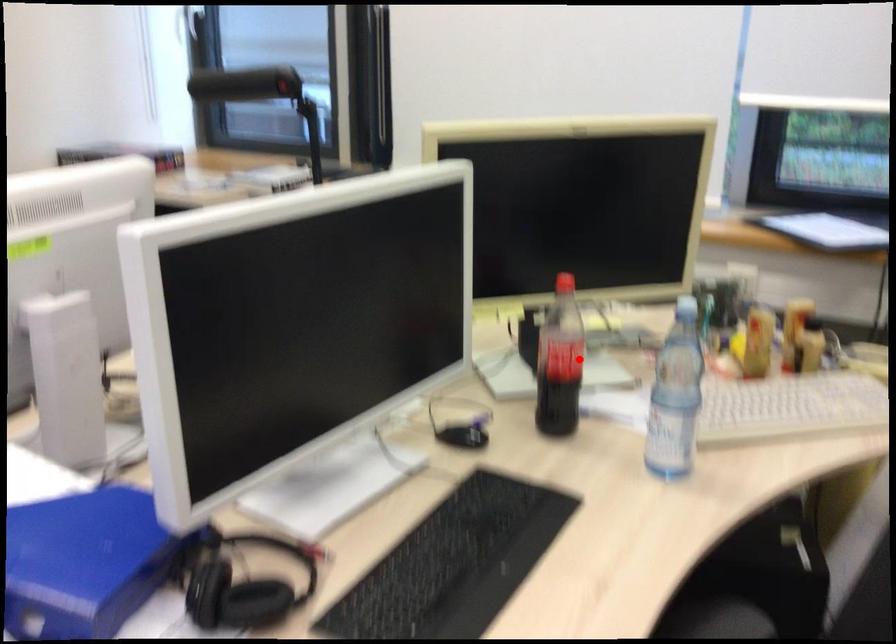
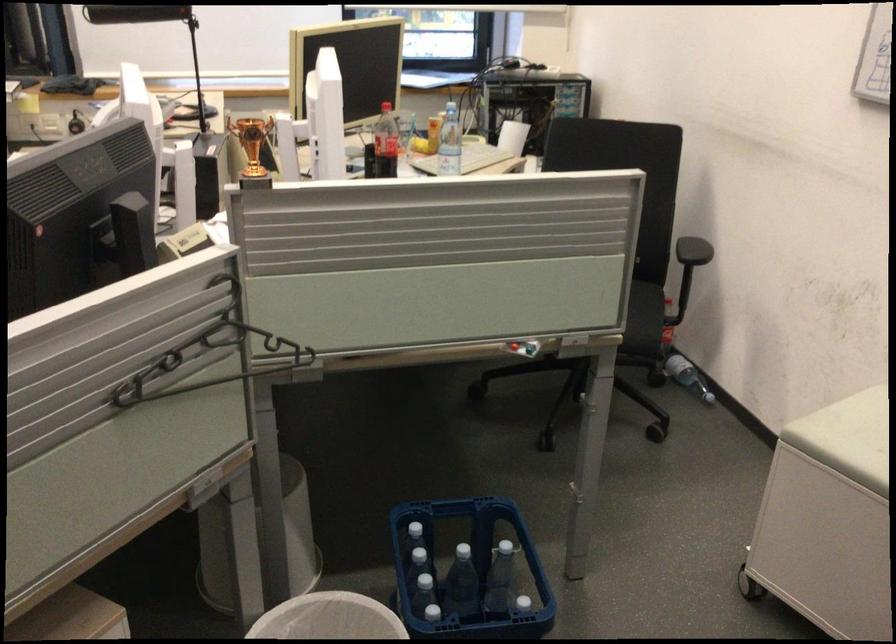
In the second image, find the point that corresponds to the highlighted location in the first image.

(385, 143)